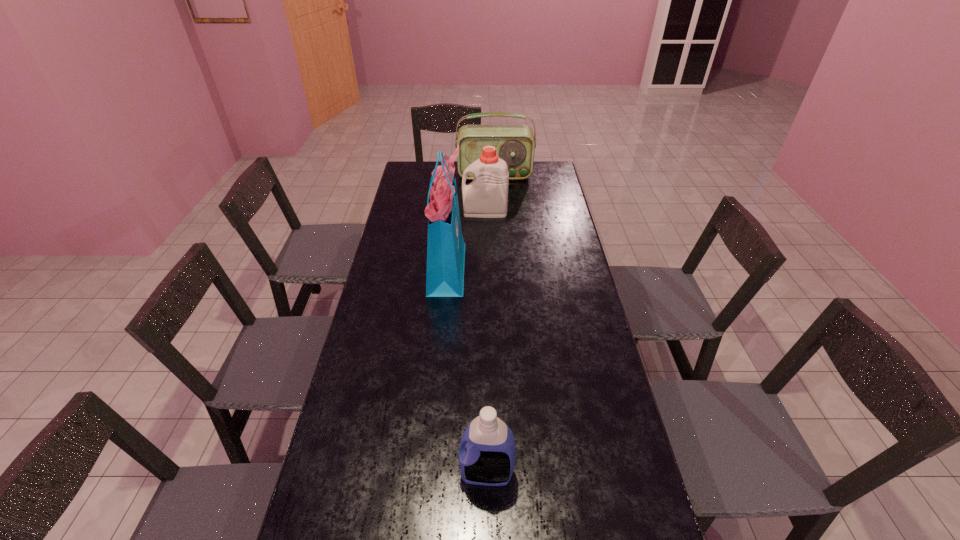
The height and width of the screenshot is (540, 960). In order to click on free region located on the back of the nearest object in this screenshot , I will do `click(485, 345)`.

The height and width of the screenshot is (540, 960). I want to click on object located at the far edge, so click(515, 144).

You are a GUI agent. You are given a task and a screenshot of the screen. Output one action in this format:
    pyautogui.click(x=<x>, y=<y>)
    Task: Click on the object that is at the right edge
    Image resolution: width=960 pixels, height=540 pixels.
    Given the screenshot: What is the action you would take?
    click(x=515, y=144)

This screenshot has width=960, height=540. Identify the location of object located at the far right corner. (515, 144).

The image size is (960, 540). In the image, there is a desktop. Find the location of `free space at the left edge`. free space at the left edge is located at coordinates coord(421,225).

I want to click on vacant space at the right edge of the desktop, so click(625, 478).

In the image, there is a desktop. Where is `free space at the far left corner`? This screenshot has width=960, height=540. free space at the far left corner is located at coordinates (435, 167).

Identify the location of vacant area between the farther detergent and the second nearest object. (466, 239).

Identify the location of vacant area between the nearest object and the second farthest object. (486, 342).

Identify the location of vacant point located between the tallest object and the farther detergent. (466, 239).